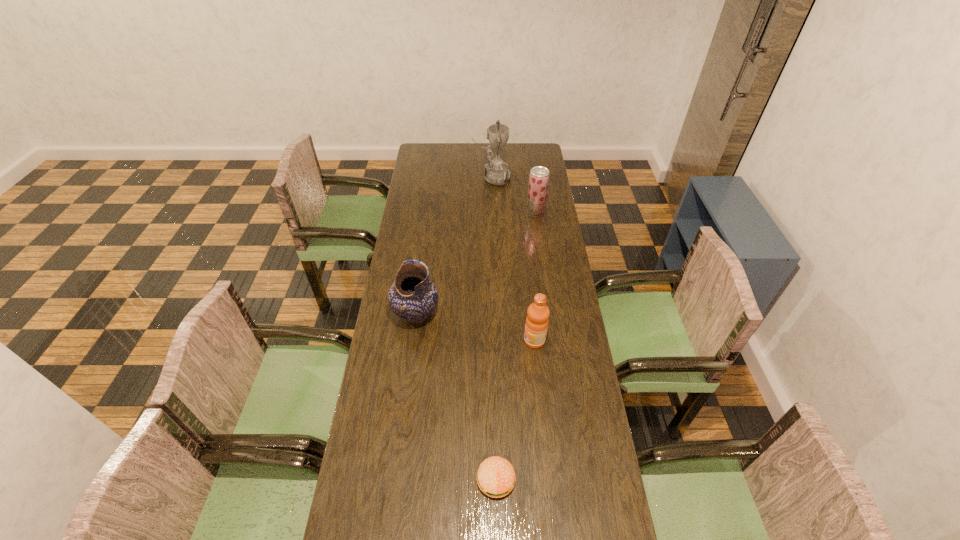
The height and width of the screenshot is (540, 960). In order to click on vacant region located 0.330m on the back of the fourth nearest object in this screenshot , I will do `click(529, 170)`.

This screenshot has height=540, width=960. I want to click on blank area located on the label side of the nearer fruit juice, so click(x=488, y=340).

The image size is (960, 540). I want to click on free spot located on the label side of the nearer fruit juice, so click(424, 340).

Find the location of a particular element. Image resolution: width=960 pixels, height=540 pixels. free space located 0.170m on the label side of the nearer fruit juice is located at coordinates (476, 340).

I want to click on vacant space positioned on the back of the leftmost object, so click(x=422, y=263).

Locate an element on the screen. The width and height of the screenshot is (960, 540). free space located on the left of the patty is located at coordinates (386, 480).

The height and width of the screenshot is (540, 960). Identify the location of object located at the left edge. (413, 296).

Identify the location of vacant area at the far edge of the desktop. This screenshot has height=540, width=960. (445, 158).

Find the location of `vacant space at the left edge of the desktop`. vacant space at the left edge of the desktop is located at coordinates (415, 188).

At what (x,y) coordinates should I click in order to perform the action: click on free region at the right edge of the desktop. Please return your answer as a coordinate pair (x, y). The height and width of the screenshot is (540, 960). Looking at the image, I should click on (525, 237).